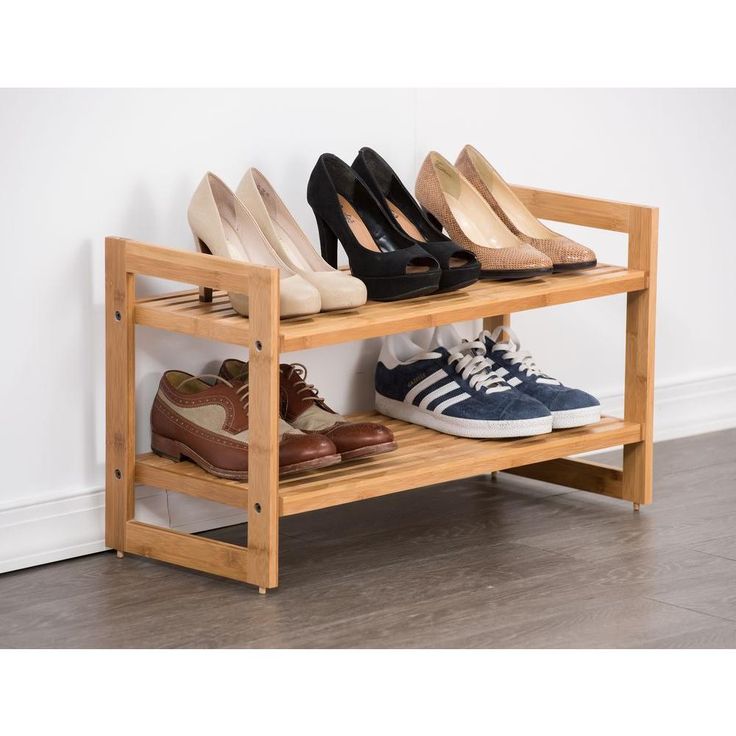
Where is `individual shoes`? This screenshot has width=736, height=736. individual shoes is located at coordinates (230, 226), (305, 250), (361, 230), (408, 218), (526, 254), (576, 250), (567, 391), (517, 410), (350, 433), (300, 453).